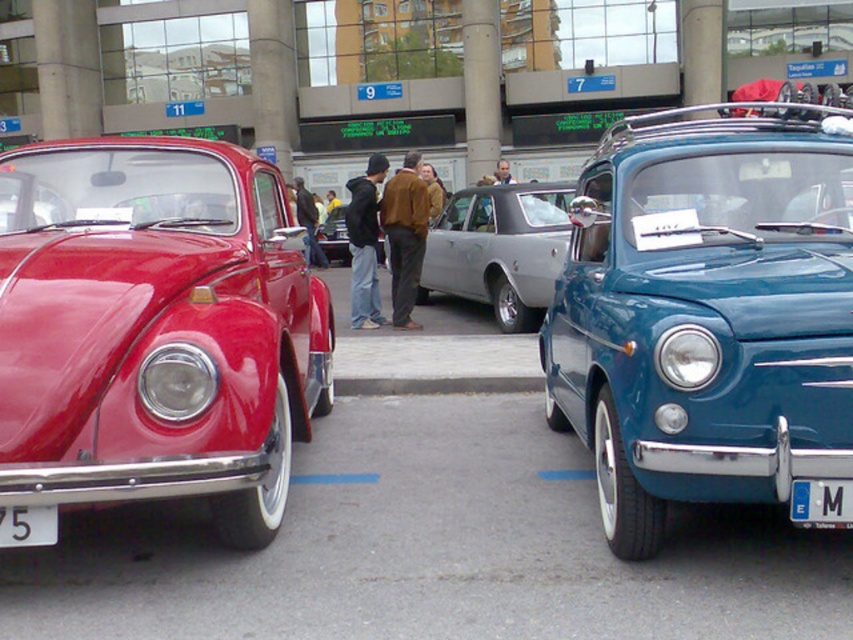
Which is in front, point (144, 474) or point (328, 260)?

Point (144, 474)

Between matte red car at left and shiny black car at center, which one appears on the left side from the viewer's perspective?

From the viewer's perspective, shiny black car at center appears more on the left side.

Find the location of `matte red car at left`. matte red car at left is located at coordinates (155, 330).

You are a GUI agent. You are given a task and a screenshot of the screen. Output one action in this format:
    pyautogui.click(x=<x>, y=<y>)
    Task: Click on the matte red car at left
    The image size is (853, 640).
    Given the screenshot: What is the action you would take?
    pos(155,330)

Is point (432, 225) positioned in front of point (28, 536)?

No, it is not.

The width and height of the screenshot is (853, 640). What do you see at coordinates (498, 250) in the screenshot?
I see `silver metallic sedan at center` at bounding box center [498, 250].

You are a GUI agent. You are given a task and a screenshot of the screen. Output one action in this format:
    pyautogui.click(x=<x>, y=<y>)
    Task: Click on the silver metallic sedan at center
    The image size is (853, 640).
    Given the screenshot: What is the action you would take?
    pyautogui.click(x=498, y=250)

Between teal glossy car at right and shiny black car at center, which one is positioned lower?

Positioned lower is shiny black car at center.

Is point (775, 332) closer to viewer compared to point (341, 208)?

Yes, point (775, 332) is in front of point (341, 208).

Is point (646, 166) farther from camera compared to point (344, 241)?

No.

Where is `teal glossy car at right`? The width and height of the screenshot is (853, 640). teal glossy car at right is located at coordinates (706, 310).